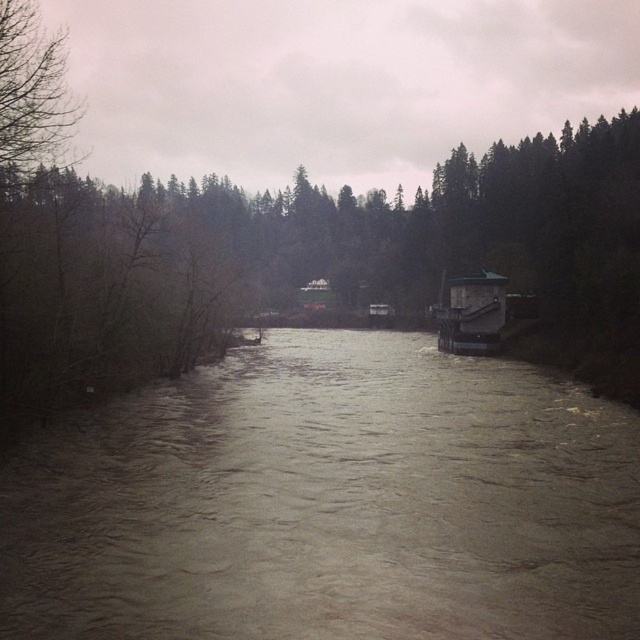
Is bare branches at upper left shorter than dark green matte boat at center?

Yes.

Is point (35, 83) in front of point (496, 321)?

Yes, it is in front of point (496, 321).

Identify the location of bare branches at upper left. (32, 96).

Can you confirm if brown muddy water at center is positioned to the right of dark green matte boat at center?

In fact, brown muddy water at center is to the left of dark green matte boat at center.

Which is below, brown muddy water at center or dark green matte boat at center?

brown muddy water at center is lower down.

Describe the element at coordinates (330, 502) in the screenshot. I see `brown muddy water at center` at that location.

Locate an element on the screen. The width and height of the screenshot is (640, 640). brown muddy water at center is located at coordinates (330, 502).

Does point (248, 464) come farther from viewer compared to point (38, 26)?

No, it is in front of (38, 26).

Describe the element at coordinates (330, 502) in the screenshot. I see `brown muddy water at center` at that location.

Is point (240, 525) positioned after point (10, 61)?

That is False.

The image size is (640, 640). Identify the location of brown muddy water at center. (330, 502).